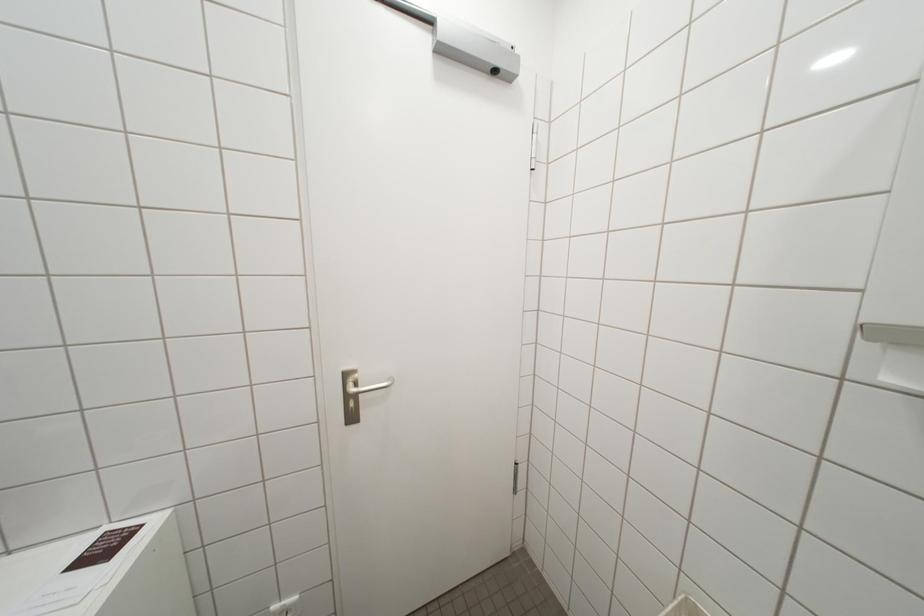
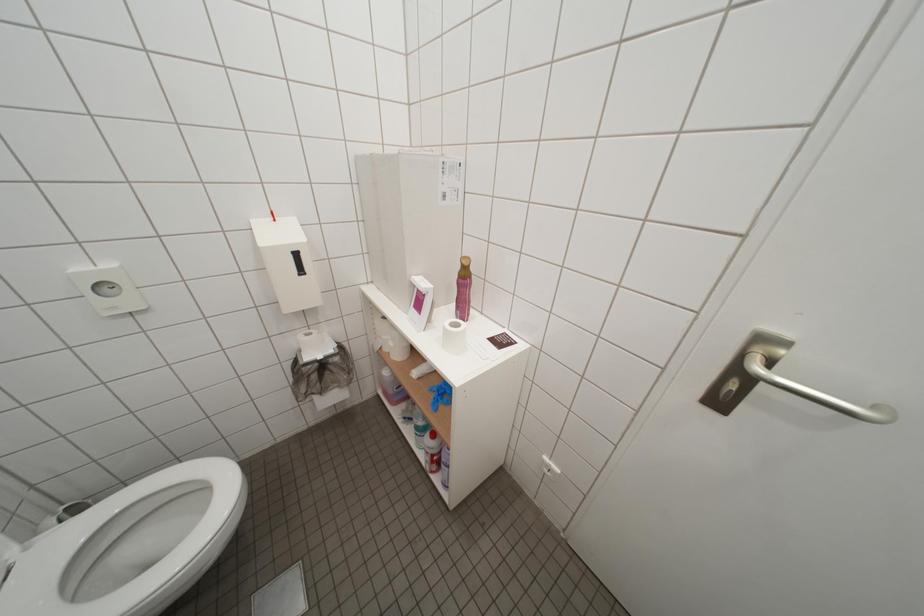
The images are taken continuously from a first-person perspective. In which direction is your viewpoint rotating?

The camera's rotation is toward left-down.